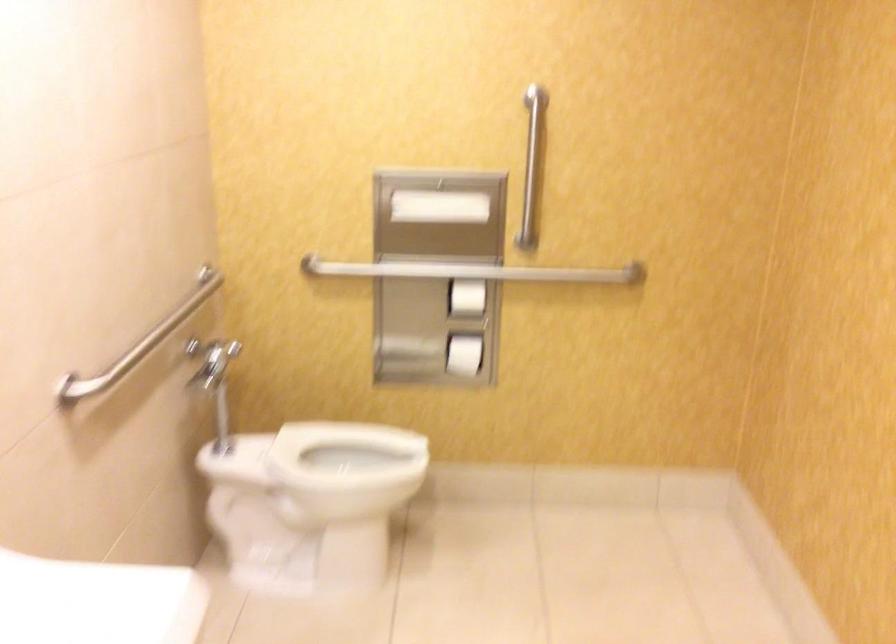
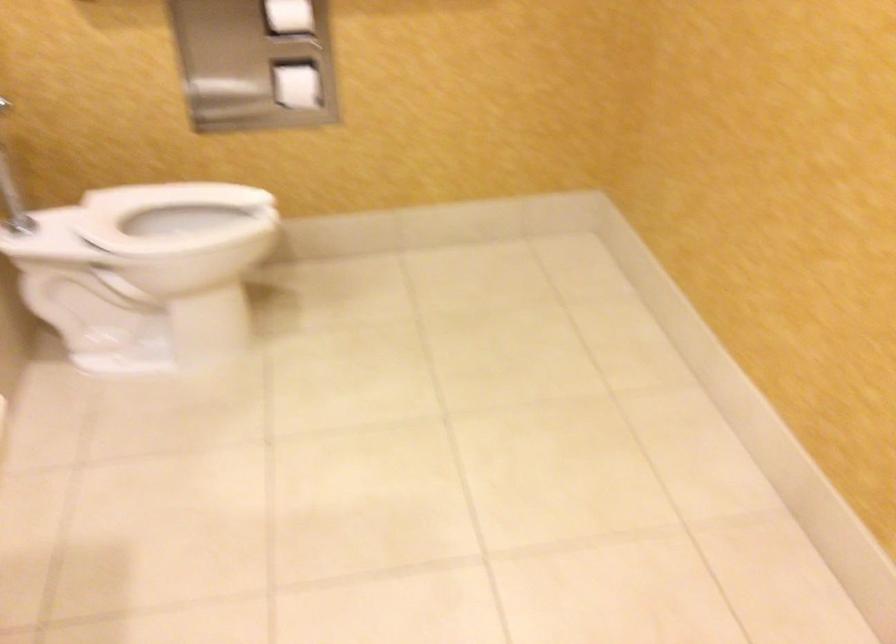
In the second image, find the point that corresponds to point (462, 354) in the first image.

(297, 86)